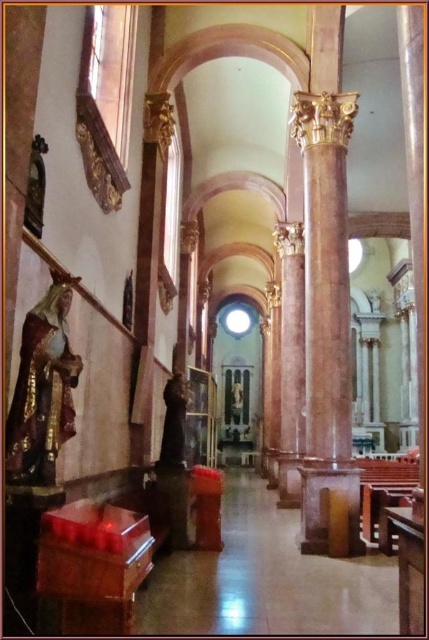
Question: Does marble column at center have a greater width compared to gold polished statue at left?

Choices:
 (A) no
 (B) yes

Answer: (B)

Question: Is marble column at center wider than gold polished statue at left?

Choices:
 (A) no
 (B) yes

Answer: (B)

Question: Among these objects, which one is farthest from the camera?

Choices:
 (A) gold polished statue at left
 (B) marble column at center

Answer: (B)

Question: Can you confirm if marble column at center is thinner than gold polished statue at left?

Choices:
 (A) yes
 (B) no

Answer: (B)